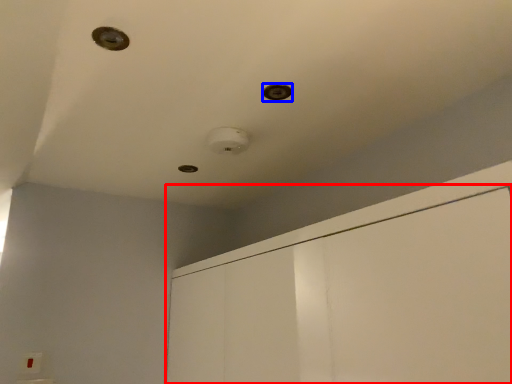
Question: Among these objects, which one is farthest to the camera, dresser (highlighted by a red box) or hole (highlighted by a blue box)?

Choices:
 (A) dresser
 (B) hole

Answer: (B)